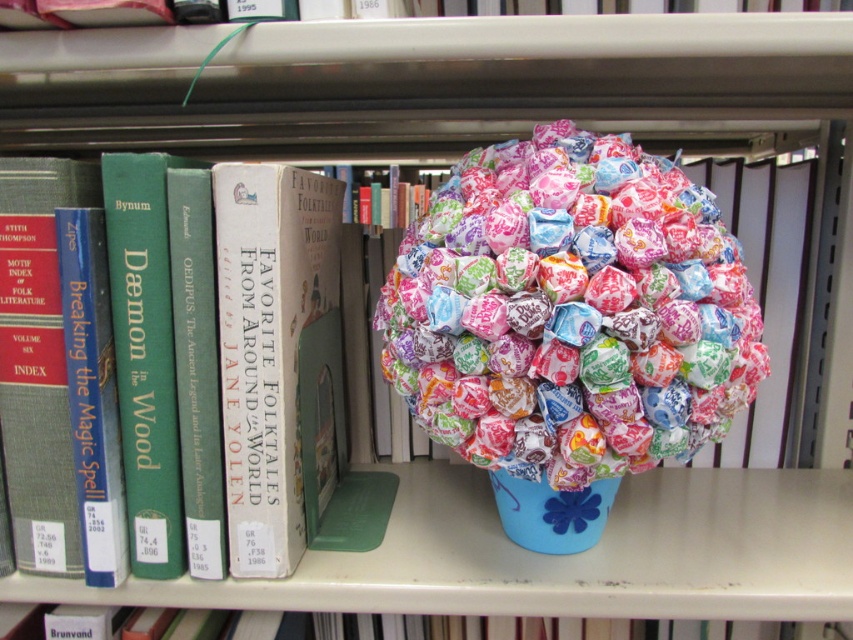
Question: Which point appears closest to the camera in this image?

Choices:
 (A) (28, 236)
 (B) (462, 397)

Answer: (B)

Question: Does colorful paper wrapped at center appear under hardcover book at left?

Choices:
 (A) yes
 (B) no

Answer: (B)

Question: Which point is closer to the camera?

Choices:
 (A) colorful paper wrapped at center
 (B) hardcover book at left

Answer: (A)

Question: Which of the following is the farthest from the observer?

Choices:
 (A) hardcover book at left
 (B) colorful paper wrapped at center

Answer: (A)

Question: Is colorful paper wrapped at center below hardcover book at left?

Choices:
 (A) no
 (B) yes

Answer: (A)

Question: Is colorful paper wrapped at center smaller than hardcover book at left?

Choices:
 (A) no
 (B) yes

Answer: (B)